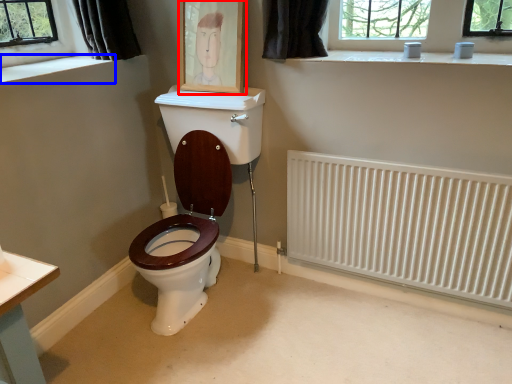
Question: Which point is closer to the camera, picture frame (highlighted by a red box) or window sill (highlighted by a blue box)?

Choices:
 (A) picture frame
 (B) window sill

Answer: (B)